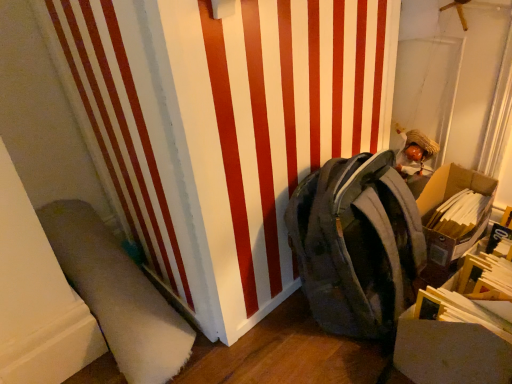
Question: From the image's perspective, is cardboard box at right located above or below camouflage fabric backpack at center-right?

Choices:
 (A) above
 (B) below

Answer: (A)

Question: Considering the positions of cardboard box at right and camouflage fabric backpack at center-right in the image, is cardboard box at right wider or thinner than camouflage fabric backpack at center-right?

Choices:
 (A) wide
 (B) thin

Answer: (B)

Question: Estimate the real-world distances between objects in this image. Which object is closer to the cardboard box at right?

Choices:
 (A) camouflage fabric backpack at center-right
 (B) white soft carpet at lower left

Answer: (A)

Question: Which object is positioned closest to the cardboard box at right?

Choices:
 (A) white soft carpet at lower left
 (B) camouflage fabric backpack at center-right

Answer: (B)